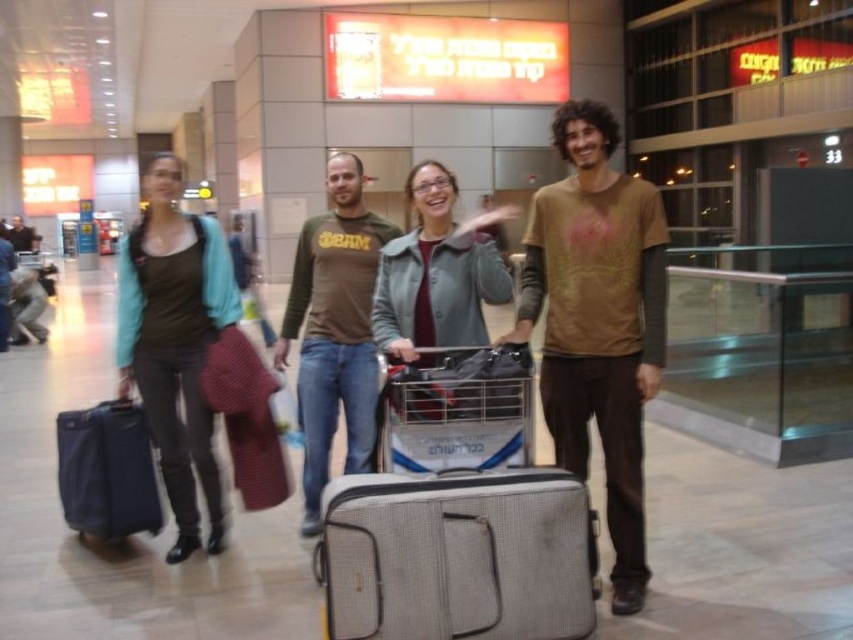
Question: Which object is farther from the camera taking this photo?

Choices:
 (A) gray fabric suitcase at center
 (B) matte blue suitcase at left

Answer: (B)

Question: Considering the real-world distances, which object is closest to the gray fabric suitcase at center?

Choices:
 (A) brown textured t-shirt at center
 (B) brown cotton shirt at center
 (C) matte gray jacket at center

Answer: (A)

Question: From the image, what is the correct spatial relationship of brown textured t-shirt at center in relation to brown cotton shirt at center?

Choices:
 (A) above
 (B) below

Answer: (A)

Question: Is matte black suitcase at left wider than matte gray jacket at center?

Choices:
 (A) no
 (B) yes

Answer: (B)

Question: Among these objects, which one is nearest to the camera?

Choices:
 (A) brown cotton shirt at center
 (B) gray fabric suitcase at center
 (C) matte gray jacket at center
 (D) matte blue suitcase at left

Answer: (B)

Question: Does gray fabric suitcase at center appear on the right side of matte blue suitcase at left?

Choices:
 (A) no
 (B) yes

Answer: (B)